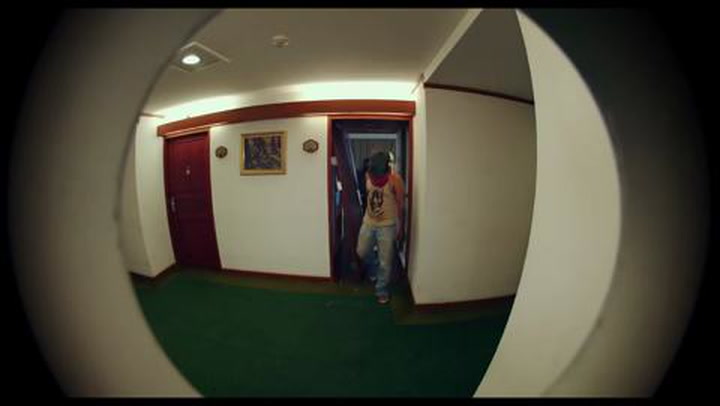
You are a GUI agent. You are given a task and a screenshot of the screen. Output one action in this format:
    pyautogui.click(x=<x>, y=<y>)
    Task: Click on the artwork on top
    
    Given the screenshot: What is the action you would take?
    pyautogui.click(x=374, y=205)